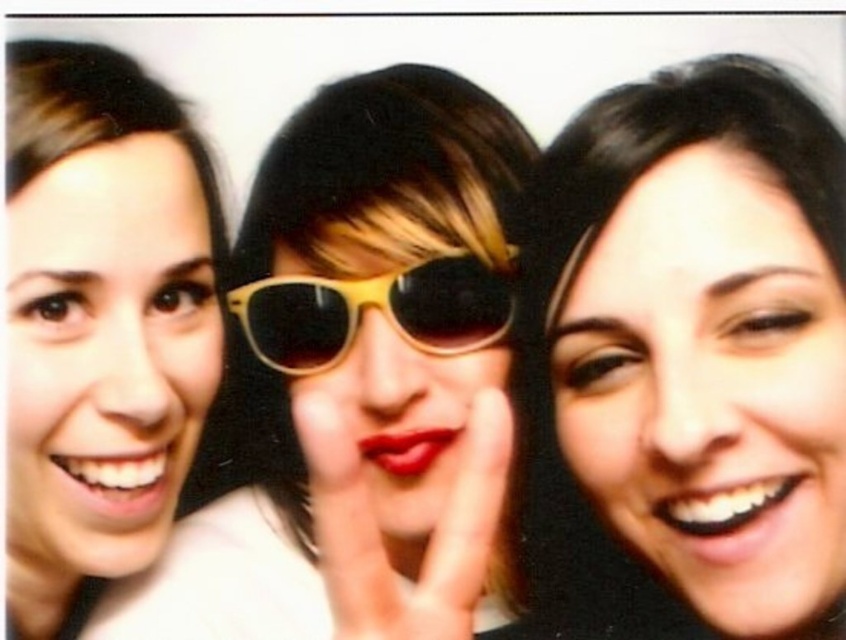
Question: Can you confirm if matte white face at left is positioned to the right of yellow plastic sunglasses at center?

Choices:
 (A) yes
 (B) no

Answer: (B)

Question: Can you confirm if matte yellow sunglasses at center is thinner than matte white face at left?

Choices:
 (A) yes
 (B) no

Answer: (B)

Question: Can you confirm if matte yellow sunglasses at center is positioned to the right of matte white face at left?

Choices:
 (A) no
 (B) yes

Answer: (B)

Question: Which of the following is the closest to the observer?

Choices:
 (A) smooth skin face at center
 (B) yellow plastic sunglasses at center

Answer: (A)

Question: Which point is closer to the camera?

Choices:
 (A) pos(89,88)
 (B) pos(443,282)

Answer: (A)

Question: Among these points, which one is nearest to the camera?

Choices:
 (A) (490, 317)
 (B) (295, 536)
 (C) (18, 150)

Answer: (C)